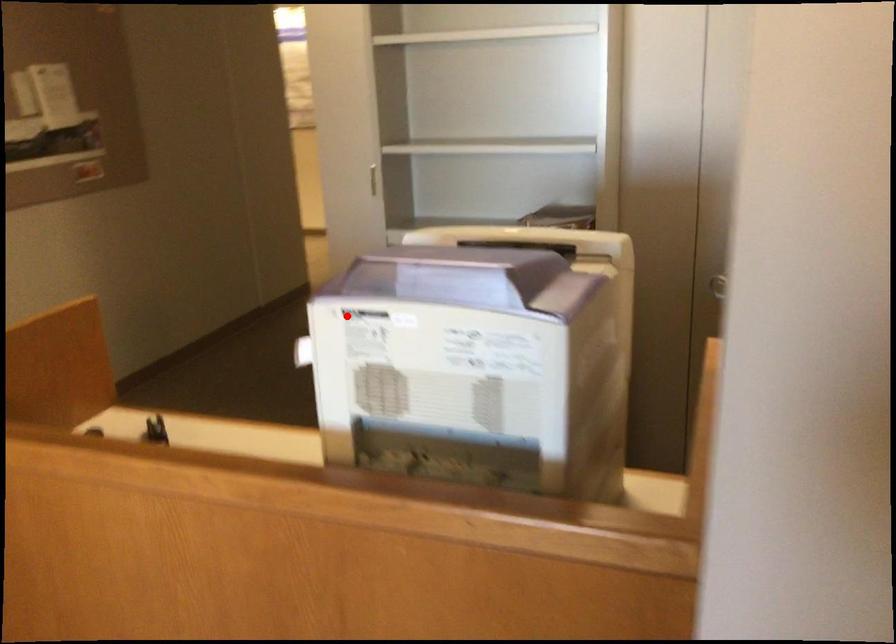
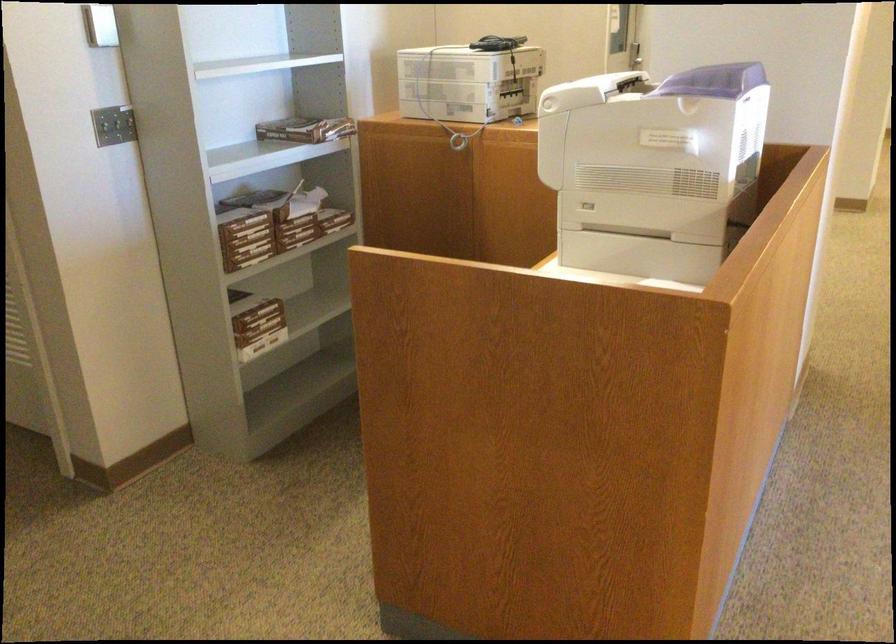
Question: I am providing you with two images of the same scene from different viewpoints. Given a red point in image1, look at the same physical point in image2. Is it:

Choices:
 (A) Closer to the viewpoint
 (B) Farther from the viewpoint

Answer: (B)